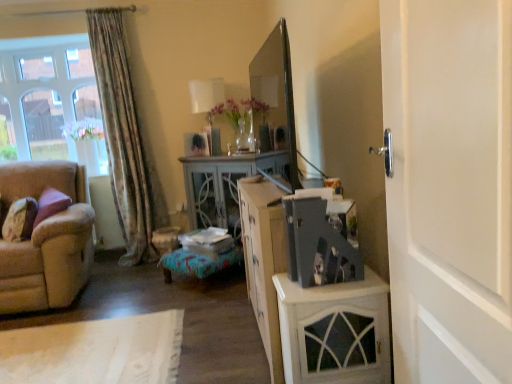
Question: In the image, is beige fabric couch at left on the left side or the right side of clear glass window at upper left?

Choices:
 (A) left
 (B) right

Answer: (B)

Question: From a real-world perspective, is beige fabric couch at left above or below clear glass window at upper left?

Choices:
 (A) below
 (B) above

Answer: (A)

Question: Considering the real-world distances, which object is farthest from the velvet purple pillow at left?

Choices:
 (A) white painted wood door at right
 (B) light gray wood desk at center
 (C) floral fabric curtain at left
 (D) matte gray photo album at center
 (E) beige fabric couch at left

Answer: (A)

Question: Which object is the farthest from the white painted wood door at right?

Choices:
 (A) matte gray photo album at center
 (B) white painted wood cabinet at right
 (C) floral fabric curtain at left
 (D) velvet purple pillow at left
 (E) light gray wood desk at center

Answer: (C)